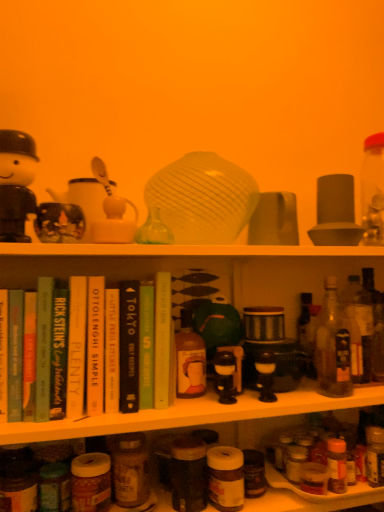
This screenshot has height=512, width=384. Find the location of `free spot in front of black hardcover book at center, the third book positioned from the right`. free spot in front of black hardcover book at center, the third book positioned from the right is located at coordinates (117, 415).